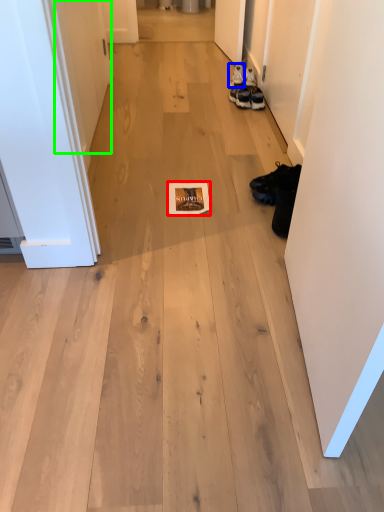
Question: Estimate the real-world distances between objects in this image. Which object is farther from magazine (highlighted by a red box), footwear (highlighted by a blue box) or door (highlighted by a green box)?

Choices:
 (A) footwear
 (B) door

Answer: (A)